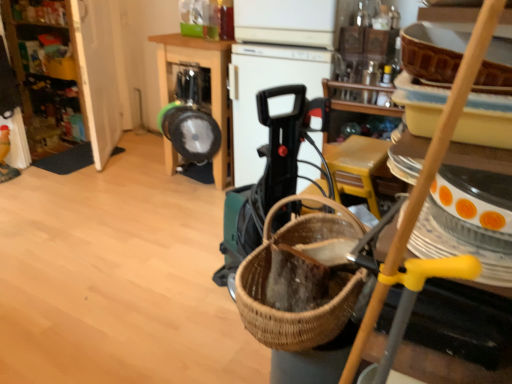
Question: Looking at the image, does black plastic vacuum cleaner at center, acting as the first appliance starting from the right, seem bigger or smaller compared to metallic silver blender at center, which is the 1th appliance in left-to-right order?

Choices:
 (A) small
 (B) big

Answer: (B)

Question: Considering the positions of black plastic vacuum cleaner at center, acting as the first appliance starting from the right, and metallic silver blender at center, which is the 1th appliance in left-to-right order, in the image, is black plastic vacuum cleaner at center, acting as the first appliance starting from the right, taller or shorter than metallic silver blender at center, which is the 1th appliance in left-to-right order,?

Choices:
 (A) short
 (B) tall

Answer: (B)

Question: Estimate the real-world distances between objects in this image. Which object is closer to the brown woven basket at center?

Choices:
 (A) wooden cabinet at left
 (B) metallic silver frying pan at center
 (C) metallic silver blender at center, placed as the 2th appliance when sorted from right to left
 (D) black plastic vacuum cleaner at center, the second appliance in the left-to-right sequence

Answer: (D)

Question: Considering the real-world distances, which object is farthest from the metallic silver frying pan at center?

Choices:
 (A) metallic silver blender at center, placed as the 2th appliance when sorted from right to left
 (B) black plastic vacuum cleaner at center, acting as the first appliance starting from the right
 (C) wooden cabinet at left
 (D) brown woven basket at center

Answer: (D)